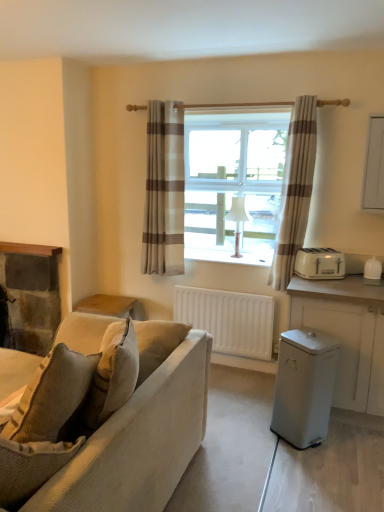
This screenshot has height=512, width=384. Identify the location of vacant area that is in front of white plastic trash can at lower right, acting as the 2th appliance starting from the back. tap(311, 461).